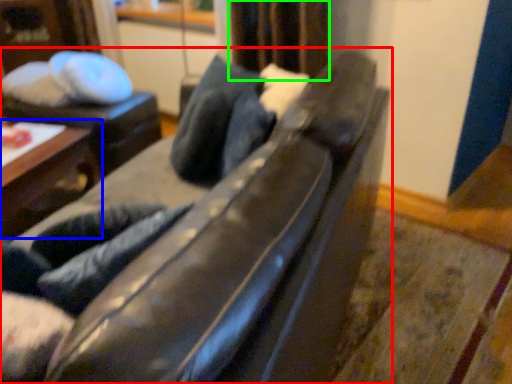
Question: Estimate the real-world distances between objects in this image. Which object is farther from studio couch (highlighted by a red box), table (highlighted by a blue box) or curtain (highlighted by a green box)?

Choices:
 (A) table
 (B) curtain

Answer: (A)